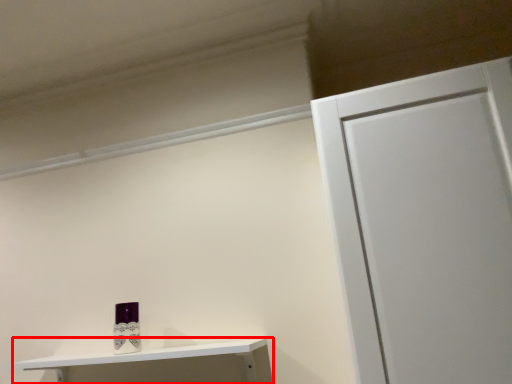
Question: From the image, what is the correct spatial relationship of shelf (annotated by the red box) in relation to toiletry?

Choices:
 (A) right
 (B) left

Answer: (A)